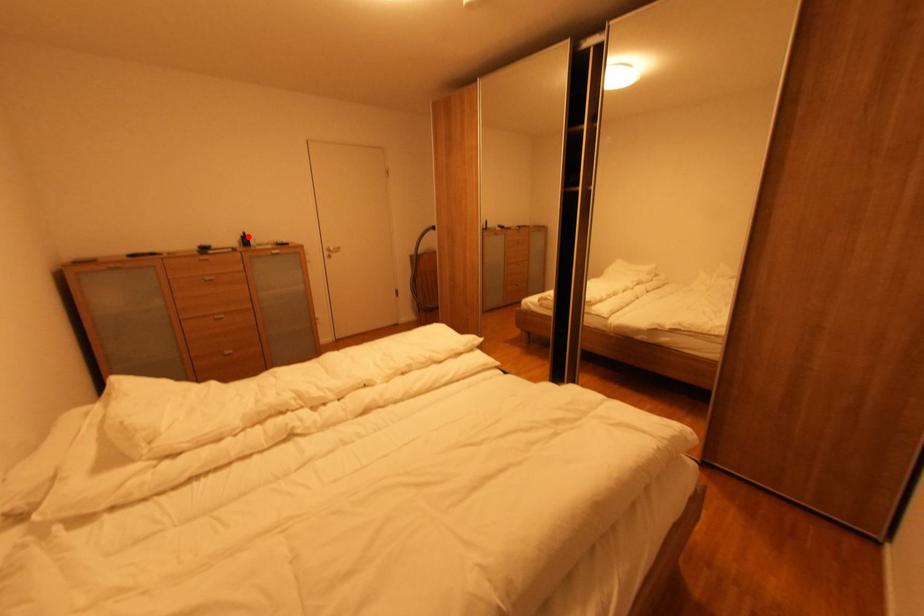
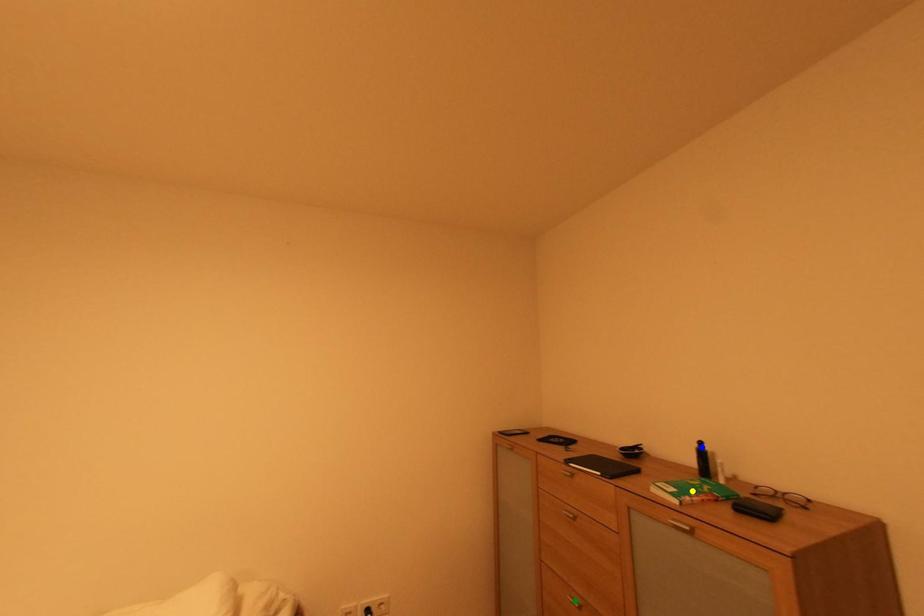
Question: I am providing you with two images of the same scene from different viewpoints. A red point is marked on the first image. You are given multiple points on the second image. In image 2, which mark is for the same physical point as the one in image 1?

Choices:
 (A) blue point
 (B) green point
 (C) yellow point

Answer: (A)